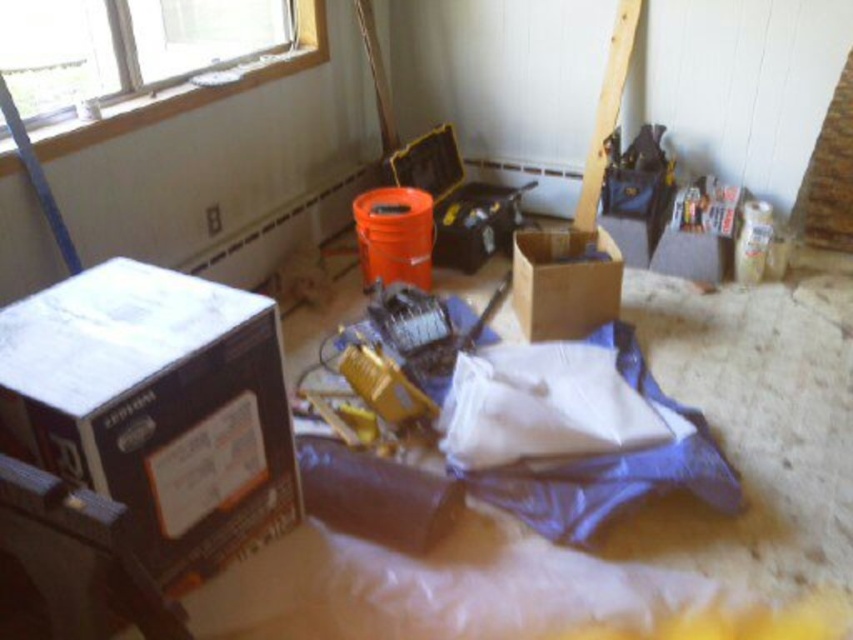
Does brown cardboard box at center appear over white painted wood window at upper left?

Actually, brown cardboard box at center is below white painted wood window at upper left.

How much distance is there between brown cardboard box at center and white painted wood window at upper left?

brown cardboard box at center and white painted wood window at upper left are 1.36 meters apart from each other.

What are the coordinates of `brown cardboard box at center` in the screenshot? It's located at (564, 282).

Does brown cardboard box at left have a lesser height compared to white painted wood window at upper left?

Indeed, brown cardboard box at left has a lesser height compared to white painted wood window at upper left.

Does brown cardboard box at left have a greater width compared to white painted wood window at upper left?

No.

Does point (254, 516) lie in front of point (183, 99)?

Yes, point (254, 516) is closer to viewer.

Locate an element on the screen. brown cardboard box at left is located at coordinates (157, 406).

Between point (292, 438) and point (517, 300), which one is positioned in front?

Point (292, 438) is more forward.

The height and width of the screenshot is (640, 853). Identify the location of brown cardboard box at left. (157, 406).